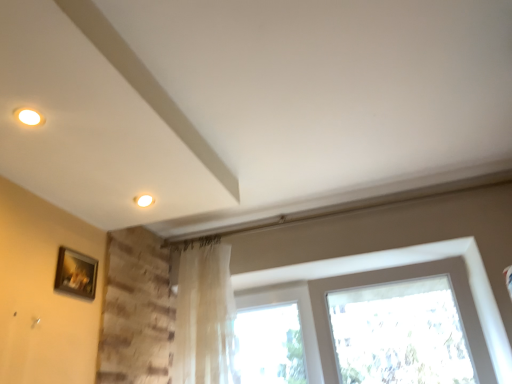
Question: Can you confirm if translucent fabric at center is taller than wooden picture frame at lower left?

Choices:
 (A) yes
 (B) no

Answer: (A)

Question: Is translucent fabric at center bigger than wooden picture frame at lower left?

Choices:
 (A) no
 (B) yes

Answer: (B)

Question: Considering the relative sizes of translucent fabric at center and wooden picture frame at lower left in the image provided, is translucent fabric at center wider than wooden picture frame at lower left?

Choices:
 (A) yes
 (B) no

Answer: (A)

Question: Is wooden picture frame at lower left inside translucent fabric at center?

Choices:
 (A) yes
 (B) no

Answer: (B)

Question: Is translucent fabric at center in contact with wooden picture frame at lower left?

Choices:
 (A) yes
 (B) no

Answer: (B)

Question: From a real-world perspective, is wooden picture frame at lower left above or below translucent fabric curtain at center?

Choices:
 (A) below
 (B) above

Answer: (B)

Question: Based on their sizes in the image, would you say wooden picture frame at lower left is bigger or smaller than translucent fabric curtain at center?

Choices:
 (A) small
 (B) big

Answer: (A)

Question: Considering the positions of point (94, 279) and point (227, 352), is point (94, 279) closer or farther from the camera than point (227, 352)?

Choices:
 (A) closer
 (B) farther

Answer: (A)

Question: Is wooden picture frame at lower left in front of or behind translucent fabric curtain at center in the image?

Choices:
 (A) front
 (B) behind

Answer: (A)

Question: Considering the positions of translucent fabric at center and translucent fabric curtain at center in the image, is translucent fabric at center taller or shorter than translucent fabric curtain at center?

Choices:
 (A) tall
 (B) short

Answer: (B)

Question: Is point (465, 294) positioned closer to the camera than point (208, 367)?

Choices:
 (A) farther
 (B) closer

Answer: (B)

Question: From a real-world perspective, is translucent fabric at center above or below translucent fabric curtain at center?

Choices:
 (A) below
 (B) above

Answer: (A)

Question: Considering the positions of translucent fabric at center and translucent fabric curtain at center in the image, is translucent fabric at center wider or thinner than translucent fabric curtain at center?

Choices:
 (A) wide
 (B) thin

Answer: (A)

Question: Is translucent fabric curtain at center wider or thinner than translucent fabric at center?

Choices:
 (A) wide
 (B) thin

Answer: (B)

Question: From a real-world perspective, is translucent fabric curtain at center above or below translucent fabric at center?

Choices:
 (A) below
 (B) above

Answer: (B)